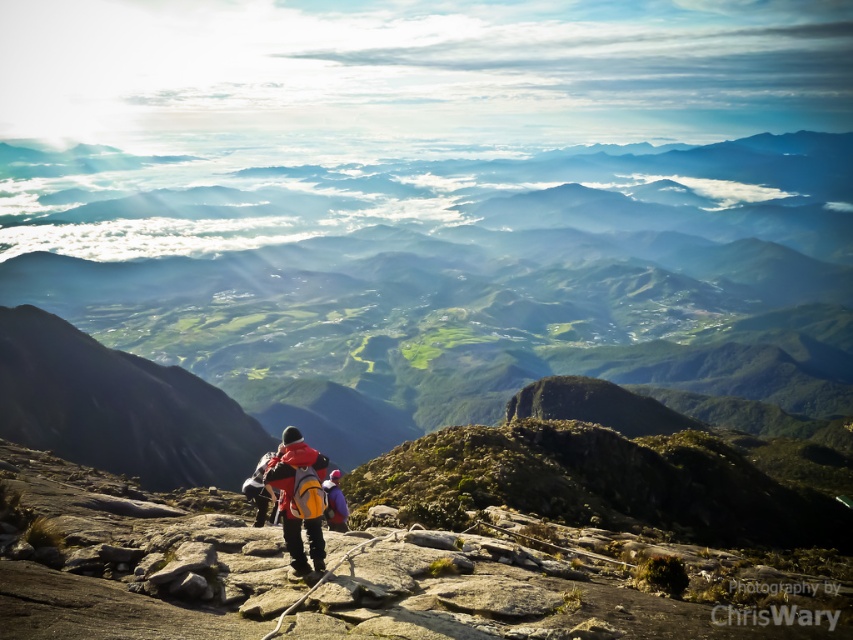
Question: Does matte orange backpack at center have a smaller size compared to matte blue jacket at center?

Choices:
 (A) no
 (B) yes

Answer: (B)

Question: Which of the following is the farthest from the observer?

Choices:
 (A) (318, 456)
 (B) (332, 518)

Answer: (B)

Question: Can you confirm if matte orange backpack at center is positioned to the right of matte blue jacket at center?

Choices:
 (A) yes
 (B) no

Answer: (A)

Question: Which object is closer to the camera taking this photo?

Choices:
 (A) matte orange backpack at center
 (B) matte blue jacket at center

Answer: (A)

Question: Does matte orange backpack at center appear under matte blue jacket at center?

Choices:
 (A) yes
 (B) no

Answer: (B)

Question: Which point is farther to the camera?

Choices:
 (A) matte blue jacket at center
 (B) matte orange backpack at center

Answer: (A)